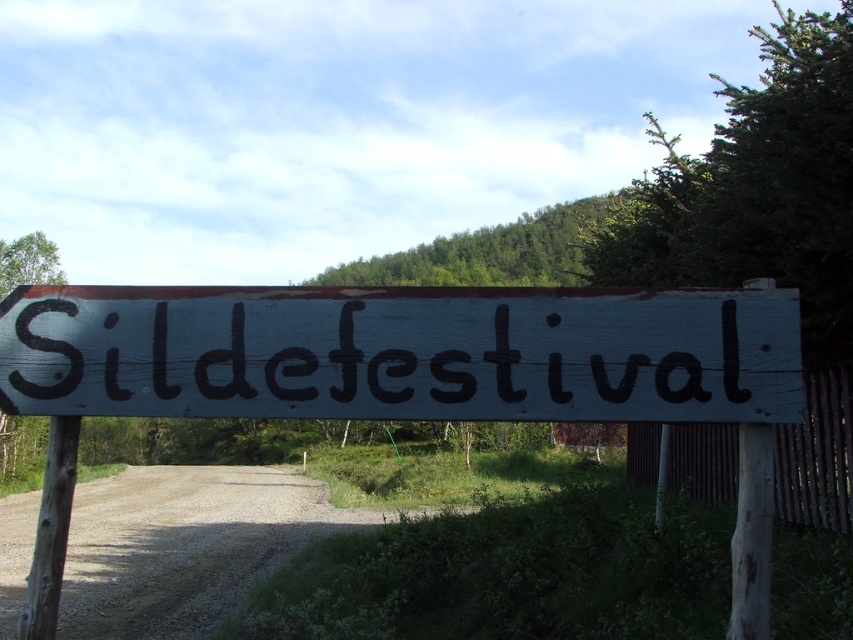
Question: Which of the following is the farthest from the observer?

Choices:
 (A) (451, 321)
 (B) (473, 392)

Answer: (A)

Question: Does white wooden signboard at center appear on the right side of wooden signboard at center?

Choices:
 (A) no
 (B) yes

Answer: (B)

Question: Among these objects, which one is farthest from the camera?

Choices:
 (A) wooden signboard at center
 (B) white wooden signboard at center

Answer: (A)

Question: Among these points, which one is nearest to the camera?

Choices:
 (A) (321, 310)
 (B) (424, 337)

Answer: (B)

Question: Is white wooden signboard at center wider than wooden signboard at center?

Choices:
 (A) yes
 (B) no

Answer: (A)

Question: Does white wooden signboard at center lie in front of wooden signboard at center?

Choices:
 (A) no
 (B) yes

Answer: (B)